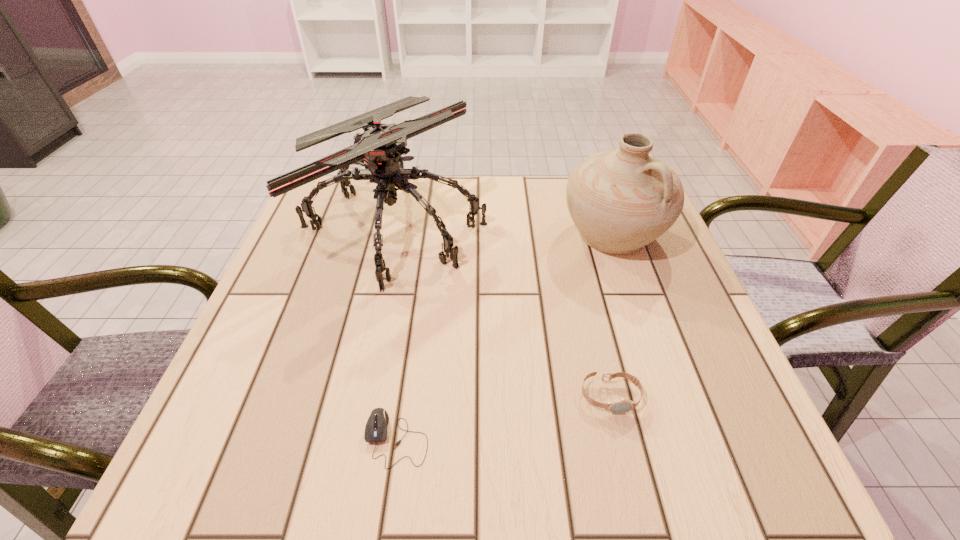
Where is `object present at the near edge`? The image size is (960, 540). object present at the near edge is located at coordinates (376, 427).

You are a GUI agent. You are given a task and a screenshot of the screen. Output one action in this format:
    pyautogui.click(x=<x>, y=<y>)
    Task: Click on the object at the left edge
    
    Given the screenshot: What is the action you would take?
    click(x=379, y=149)

The height and width of the screenshot is (540, 960). What are the coordinates of `object situated at the right edge` in the screenshot? It's located at (620, 200).

Find the location of a particular element. object situated at the far left corner is located at coordinates (379, 149).

Identify the location of object at the far right corner. (620, 200).

You are a GUI agent. You are given a task and a screenshot of the screen. Output one action in this format:
    pyautogui.click(x=<x>, y=<y>)
    Task: Click on the vacant area at the far edge of the desktop
    The height and width of the screenshot is (540, 960).
    Given the screenshot: What is the action you would take?
    pyautogui.click(x=520, y=198)

Find the location of `vacant space at the left edge`. vacant space at the left edge is located at coordinates (292, 240).

The height and width of the screenshot is (540, 960). Identify the location of free spot at the right edge of the desktop. (731, 370).

In the image, there is a desktop. Where is `vacant space at the far left corner`? vacant space at the far left corner is located at coordinates (325, 176).

Find the location of `vacant space at the near left corner of the desktop`. vacant space at the near left corner of the desktop is located at coordinates (210, 434).